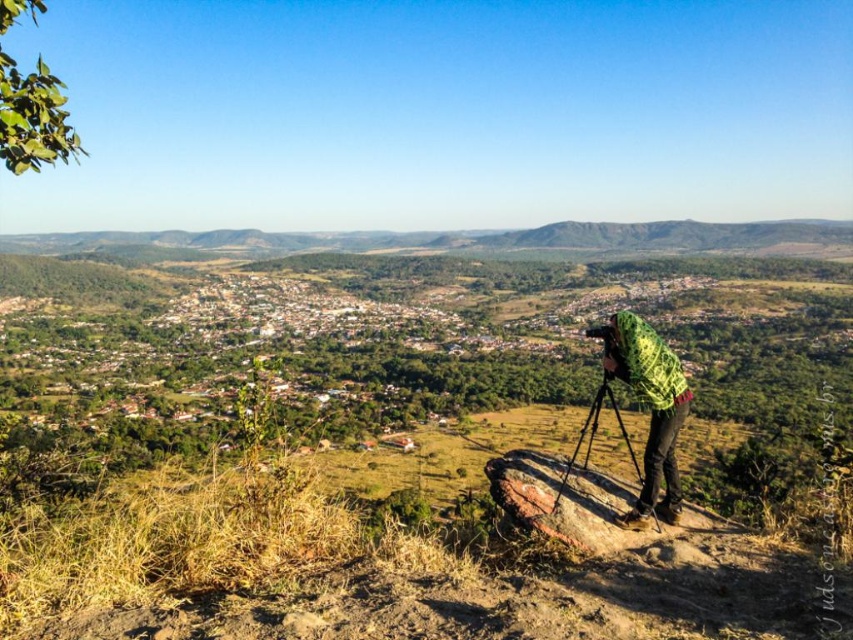
Does green knitted sweater at center appear over metallic tripod at center?

Yes.

Find the location of a particular element. The height and width of the screenshot is (640, 853). green knitted sweater at center is located at coordinates (650, 410).

Who is more forward, (642, 333) or (612, 348)?

Point (642, 333) is in front.

Where is `green knitted sweater at center`? green knitted sweater at center is located at coordinates (650, 410).